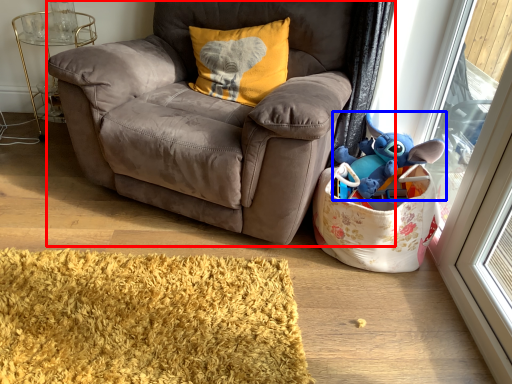
Question: Which object appears closest to the camera in this image, chair (highlighted by a red box) or toy (highlighted by a blue box)?

Choices:
 (A) chair
 (B) toy

Answer: (A)